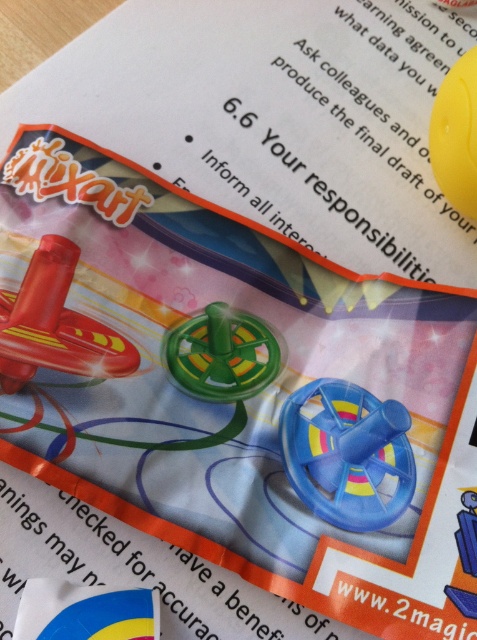
Question: Which point is closer to the camera taking this photo?

Choices:
 (A) (454, 147)
 (B) (62, 284)
 (C) (116, 604)

Answer: (C)

Question: Observing the image, what is the correct spatial positioning of shiny red toy airplane at upper left in reference to yellow rubber ball at upper right?

Choices:
 (A) below
 (B) above

Answer: (A)

Question: Which point is farther from the camera taking this photo?

Choices:
 (A) (176, 332)
 (B) (344, 476)
 (C) (149, 605)
 (D) (464, 147)

Answer: (A)

Question: Which of the following is the farthest from the observer?

Choices:
 (A) (405, 490)
 (B) (102, 360)
 (C) (142, 616)
 (D) (259, 369)

Answer: (D)

Question: Observing the image, what is the correct spatial positioning of blue glossy flag at lower left in reference to yellow rubber ball at upper right?

Choices:
 (A) right
 (B) left

Answer: (B)

Question: Observing the image, what is the correct spatial positioning of blue glossy flag at lower left in reference to yellow rubber ball at upper right?

Choices:
 (A) left
 (B) right

Answer: (A)